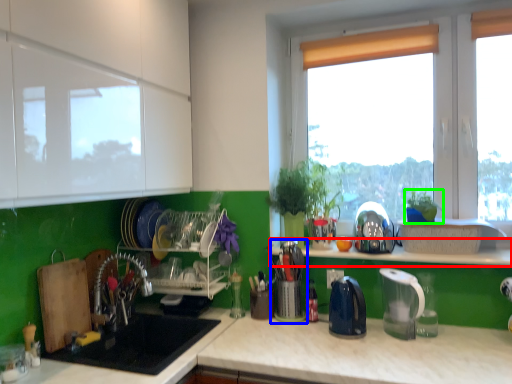
Question: Which is farther away from window sill (highlighted by a red box)? appliance (highlighted by a blue box) or plant (highlighted by a green box)?

Choices:
 (A) appliance
 (B) plant

Answer: (A)